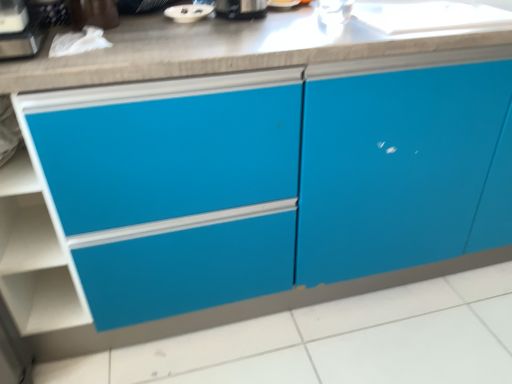
Where is `white glossy bowl at upper center`? The height and width of the screenshot is (384, 512). white glossy bowl at upper center is located at coordinates (188, 12).

The height and width of the screenshot is (384, 512). What do you see at coordinates (188, 12) in the screenshot?
I see `white glossy bowl at upper center` at bounding box center [188, 12].

Identify the location of white glossy bowl at upper center. (188, 12).